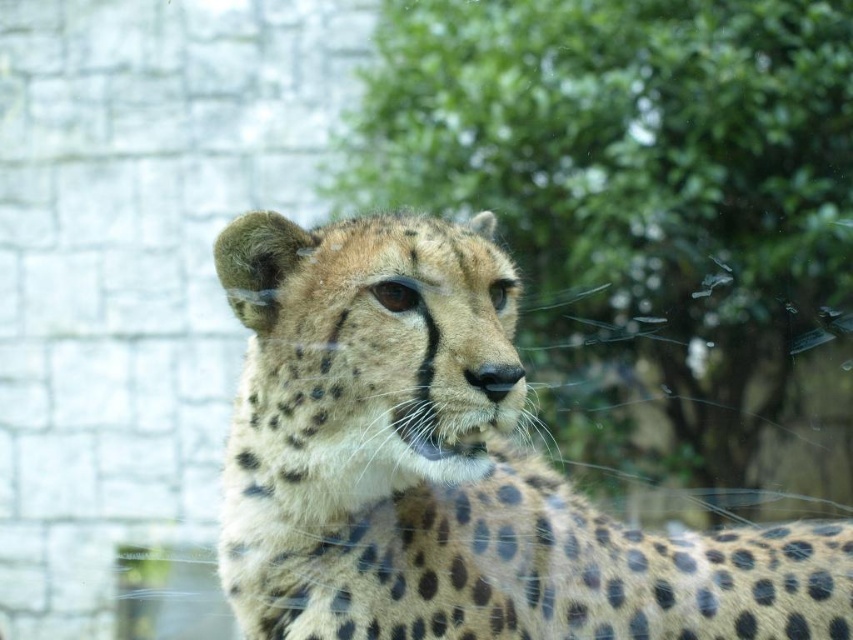
Is green leafy tree at upper center in front of spotted fur cheetah at center?

That is False.

Between green leafy tree at upper center and spotted fur cheetah at center, which one appears on the right side from the viewer's perspective?

Positioned to the right is green leafy tree at upper center.

Is point (796, 401) closer to viewer compared to point (747, 550)?

No, it is behind (747, 550).

You are a GUI agent. You are given a task and a screenshot of the screen. Output one action in this format:
    pyautogui.click(x=<x>, y=<y>)
    Task: Click on the green leafy tree at upper center
    Image resolution: width=853 pixels, height=640 pixels.
    Given the screenshot: What is the action you would take?
    tap(641, 212)